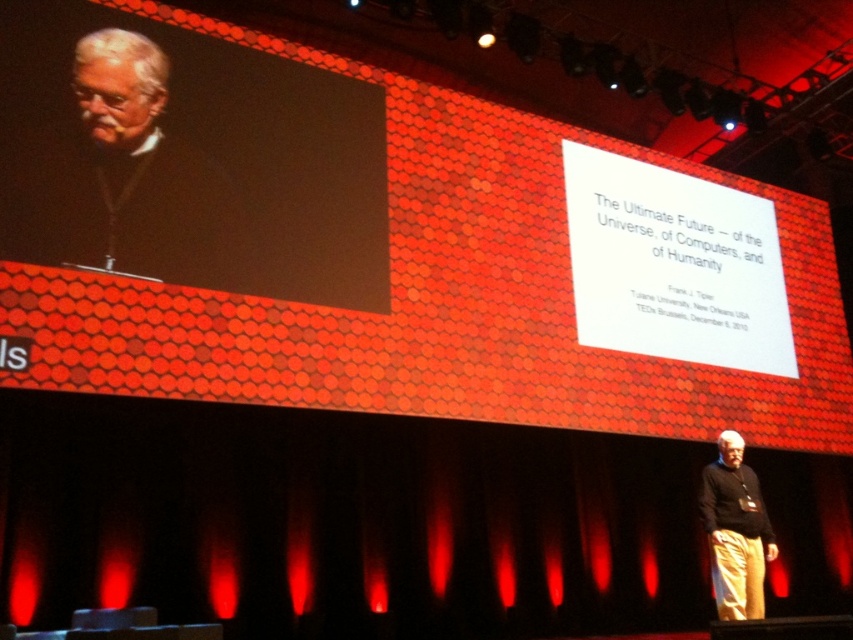
You are standing at the point marked as point (96, 186) on the stage during a TEDx event. The speaker is on the right side of the stage. If you want to move to the large screen displayed behind the speaker, which direction should you walk towards?

You should walk towards the left side of the stage because the large screen is behind the speaker, who is on the right side of the stage. Moving left would lead you toward the screen.

Based on the provided scene description, what object is located at the coordinates point [196,164]?

The point [196,164] corresponds to the black matte screen at upper left.

You are standing on the stage and want to walk towards the point that is closer to the audience. Which point should you walk towards, point (x=22, y=212) or point (x=39, y=173)?

You should walk towards point (x=22, y=212) because it is in front of point (x=39, y=173), making it closer to the audience.